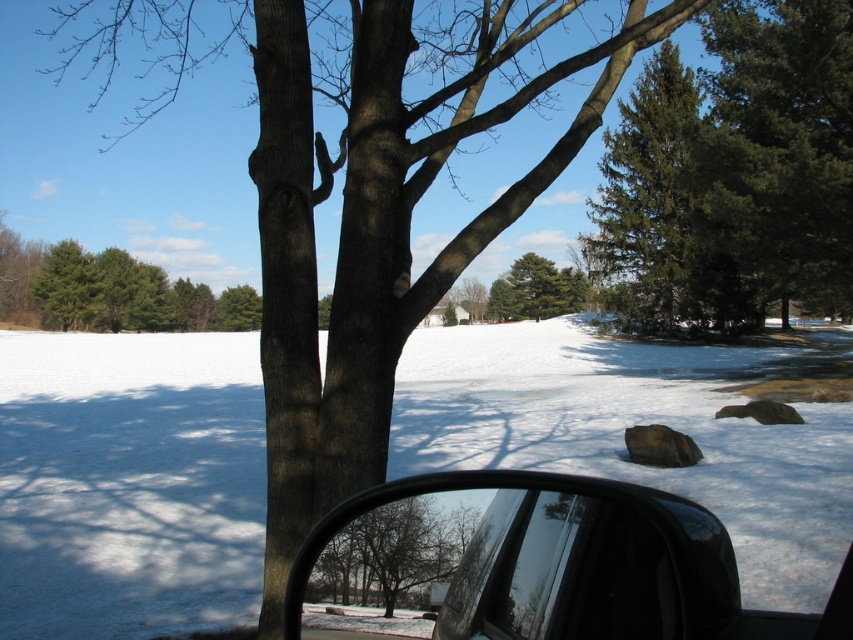
You are a hiker trying to navigate through the snowy landscape. You see the green textured pine tree at upper right and the green matte tree at upper left. Which tree would block your view of the other if you were standing between them?

The green textured pine tree at upper right is in front of the green matte tree at upper left, so it would block your view of the green matte tree at upper left.

You are standing in the winter scene and want to move from the point closer to you to the point further away. Which path would you take between the two points, point (444, 545) and point (851, 173)?

You should move from point (444, 545) to point (851, 173) since point (444, 545) is closer to the camera and the other is further away.

You are standing in the snowy landscape and want to take a photo of both the black glossy side mirror at lower right and the green matte tree at center. Which object should you adjust your camera angle to look up or down to include both in the frame?

Since the black glossy side mirror at lower right is below the green matte tree at center, you should adjust your camera angle to look up to include both in the frame.